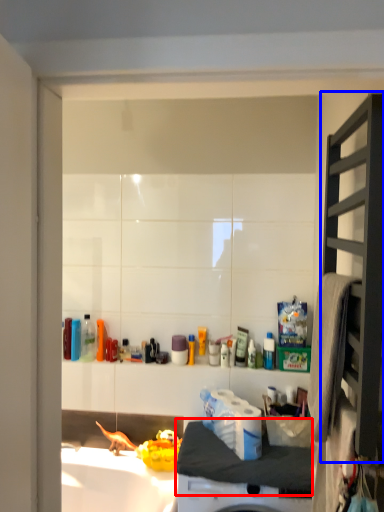
Question: Which object is further to the camera taking this photo, counter top (highlighted by a red box) or shelf (highlighted by a blue box)?

Choices:
 (A) counter top
 (B) shelf

Answer: (A)